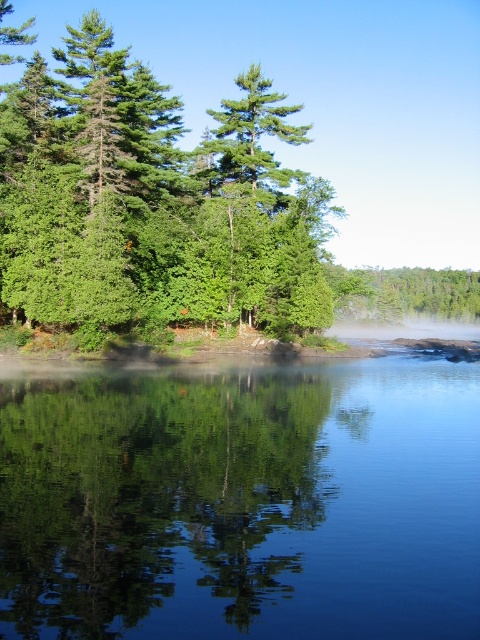
Question: Does transparent glass water at center lie behind green leafy trees at upper left?

Choices:
 (A) no
 (B) yes

Answer: (A)

Question: Does transparent glass water at center appear on the left side of green leafy trees at upper left?

Choices:
 (A) yes
 (B) no

Answer: (B)

Question: Does transparent glass water at center appear over green leafy trees at upper left?

Choices:
 (A) no
 (B) yes

Answer: (A)

Question: Which object is farther from the camera taking this photo?

Choices:
 (A) green leafy trees at upper left
 (B) transparent glass water at center

Answer: (A)